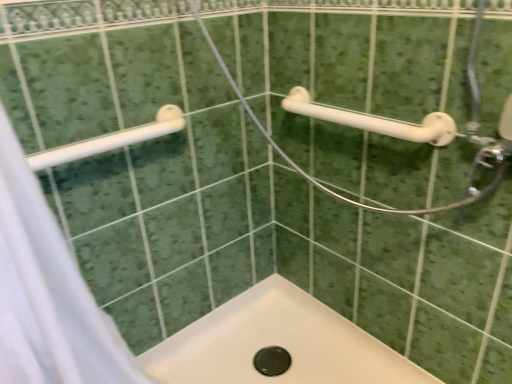
Question: Are white plastic grab bar at upper right, placed as the 2th towel rack when sorted from left to right, and white plastic towel rack at upper left, positioned as the 1th towel rack in left-to-right order, beside each other?

Choices:
 (A) yes
 (B) no

Answer: (B)

Question: Is white plastic grab bar at upper right, placed as the 2th towel rack when sorted from left to right, smaller than white plastic towel rack at upper left, the 2th towel rack viewed from the right?

Choices:
 (A) yes
 (B) no

Answer: (B)

Question: From the image's perspective, would you say white plastic grab bar at upper right, acting as the first towel rack starting from the right, is positioned over white plastic towel rack at upper left, positioned as the 1th towel rack in left-to-right order?

Choices:
 (A) yes
 (B) no

Answer: (A)

Question: From a real-world perspective, is white plastic grab bar at upper right, acting as the first towel rack starting from the right, positioned under white plastic towel rack at upper left, positioned as the 1th towel rack in left-to-right order, based on gravity?

Choices:
 (A) no
 (B) yes

Answer: (B)

Question: Considering the relative sizes of white plastic grab bar at upper right, placed as the 2th towel rack when sorted from left to right, and white plastic towel rack at upper left, the 2th towel rack viewed from the right, in the image provided, is white plastic grab bar at upper right, placed as the 2th towel rack when sorted from left to right, bigger than white plastic towel rack at upper left, the 2th towel rack viewed from the right,?

Choices:
 (A) yes
 (B) no

Answer: (A)

Question: Is white plastic grab bar at upper right, acting as the first towel rack starting from the right, not inside white plastic towel rack at upper left, the 2th towel rack viewed from the right?

Choices:
 (A) yes
 (B) no

Answer: (A)

Question: Does white plastic grab bar at upper right, acting as the first towel rack starting from the right, have a smaller size compared to white fabric shower curtain at left?

Choices:
 (A) no
 (B) yes

Answer: (B)

Question: Is white plastic grab bar at upper right, acting as the first towel rack starting from the right, further to the viewer compared to white fabric shower curtain at left?

Choices:
 (A) yes
 (B) no

Answer: (A)

Question: Is white fabric shower curtain at left a part of white plastic grab bar at upper right, placed as the 2th towel rack when sorted from left to right?

Choices:
 (A) no
 (B) yes

Answer: (A)

Question: From a real-world perspective, is white plastic grab bar at upper right, acting as the first towel rack starting from the right, on white fabric shower curtain at left?

Choices:
 (A) yes
 (B) no

Answer: (A)

Question: Considering the relative positions of white plastic grab bar at upper right, placed as the 2th towel rack when sorted from left to right, and white fabric shower curtain at left in the image provided, is white plastic grab bar at upper right, placed as the 2th towel rack when sorted from left to right, to the left of white fabric shower curtain at left from the viewer's perspective?

Choices:
 (A) yes
 (B) no

Answer: (B)

Question: Can you confirm if white plastic grab bar at upper right, placed as the 2th towel rack when sorted from left to right, is taller than white fabric shower curtain at left?

Choices:
 (A) no
 (B) yes

Answer: (A)

Question: Does white plastic towel rack at upper left, the 2th towel rack viewed from the right, turn towards white fabric shower curtain at left?

Choices:
 (A) yes
 (B) no

Answer: (A)